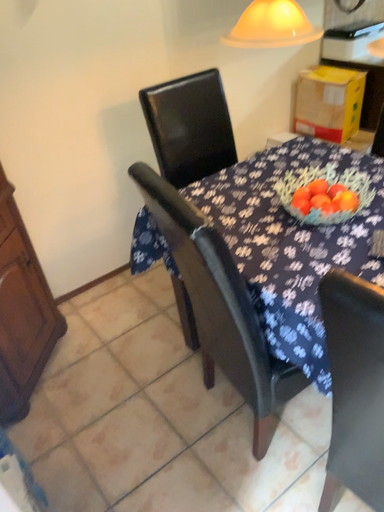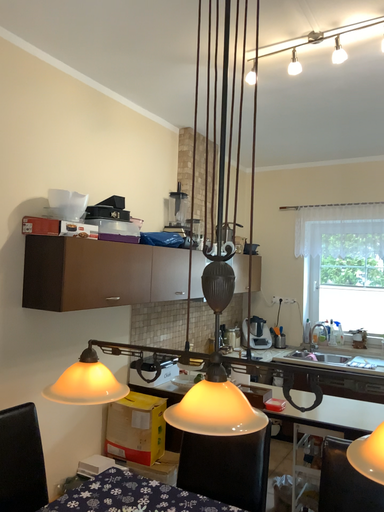
Question: How did the camera likely rotate when shooting the video?

Choices:
 (A) rotated downward
 (B) rotated upward

Answer: (B)